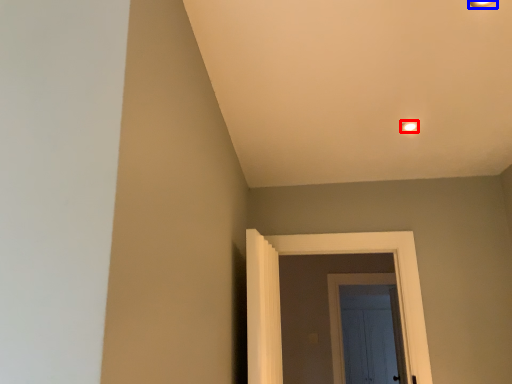
Question: Which of the following is the farthest to the observer, light fixture (highlighted by a red box) or light fixture (highlighted by a blue box)?

Choices:
 (A) light fixture
 (B) light fixture

Answer: (A)